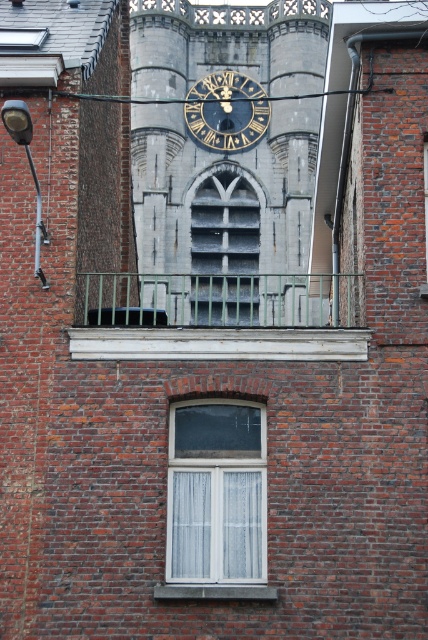
Can you confirm if gray stone clock tower at center is shorter than blue metallic clock at center?

No.

Looking at this image, does gray stone clock tower at center have a greater width compared to blue metallic clock at center?

Yes, gray stone clock tower at center is wider than blue metallic clock at center.

Which is in front, point (165, 8) or point (184, 104)?

Positioned in front is point (184, 104).

Locate an element on the screen. The height and width of the screenshot is (640, 428). gray stone clock tower at center is located at coordinates (225, 198).

Between blue metallic clock at center and metallic wire at upper center, which one has more height?

metallic wire at upper center

Can you confirm if blue metallic clock at center is wider than metallic wire at upper center?

No, blue metallic clock at center is not wider than metallic wire at upper center.

Is point (225, 72) positioned in front of point (368, 86)?

No, it is behind (368, 86).

At what (x,y) coordinates should I click in order to perform the action: click on blue metallic clock at center. Please return your answer as a coordinate pair (x, y). The height and width of the screenshot is (640, 428). Looking at the image, I should click on (226, 109).

Does gray stone clock tower at center have a larger size compared to metallic wire at upper center?

Yes, gray stone clock tower at center is bigger than metallic wire at upper center.

Between point (225, 84) and point (154, 99), which one is positioned in front?

Point (154, 99)

Who is more forward, (x=181, y=48) or (x=107, y=99)?

Positioned in front is point (x=107, y=99).

What are the coordinates of `gray stone clock tower at center` in the screenshot? It's located at (225, 198).